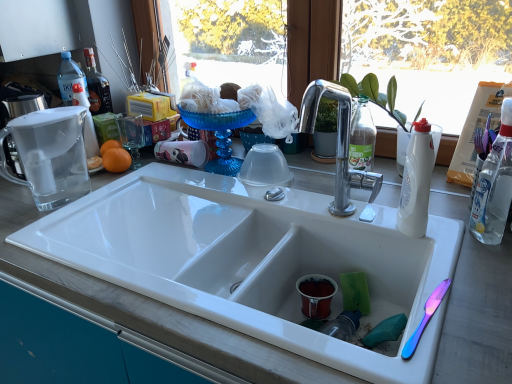
Question: Does white ceramic sink at center have a greater height compared to clear glass pitcher at upper left?

Choices:
 (A) no
 (B) yes

Answer: (B)

Question: Is white ceramic sink at center facing away from clear glass pitcher at upper left?

Choices:
 (A) no
 (B) yes

Answer: (A)

Question: Is white ceramic sink at center completely or partially outside of clear glass pitcher at upper left?

Choices:
 (A) no
 (B) yes

Answer: (B)

Question: Is the position of white ceramic sink at center more distant than that of clear glass pitcher at upper left?

Choices:
 (A) no
 (B) yes

Answer: (A)

Question: Is the surface of white ceramic sink at center in direct contact with clear glass pitcher at upper left?

Choices:
 (A) yes
 (B) no

Answer: (B)

Question: Is white ceramic sink at center wider than clear glass pitcher at upper left?

Choices:
 (A) yes
 (B) no

Answer: (A)

Question: Considering the relative sizes of clear glass pitcher at upper left and orangesmoothfruit at left in the image provided, is clear glass pitcher at upper left wider than orangesmoothfruit at left?

Choices:
 (A) no
 (B) yes

Answer: (B)

Question: Can you see clear glass pitcher at upper left touching orangesmoothfruit at left?

Choices:
 (A) yes
 (B) no

Answer: (B)

Question: Does clear glass pitcher at upper left appear on the left side of orangesmoothfruit at left?

Choices:
 (A) yes
 (B) no

Answer: (A)

Question: Does clear glass pitcher at upper left have a smaller size compared to orangesmoothfruit at left?

Choices:
 (A) no
 (B) yes

Answer: (A)

Question: Considering the relative sizes of clear glass pitcher at upper left and orangesmoothfruit at left in the image provided, is clear glass pitcher at upper left shorter than orangesmoothfruit at left?

Choices:
 (A) yes
 (B) no

Answer: (B)

Question: Is clear glass pitcher at upper left outside of orangesmoothfruit at left?

Choices:
 (A) no
 (B) yes

Answer: (B)

Question: Considering the relative sizes of clear glass pitcher at upper left and white plastic bottle at right, which is counted as the second bottle, starting from the left, in the image provided, is clear glass pitcher at upper left shorter than white plastic bottle at right, which is counted as the second bottle, starting from the left,?

Choices:
 (A) yes
 (B) no

Answer: (B)